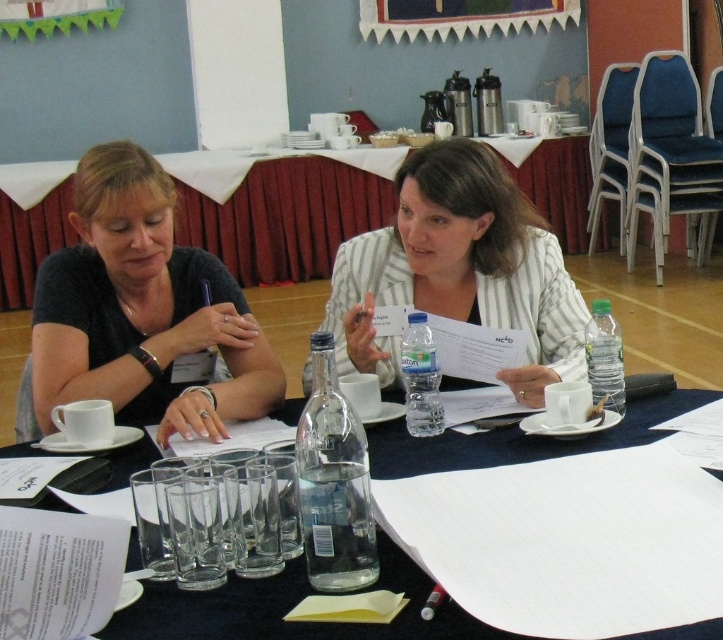
You are organizing a small event and need to decide where to place a new decorative item. Given the current setup, which object would allow more space for the item when placed next to it, the matte black shirt at left or the wooden bulletin board at upper center?

The wooden bulletin board at upper center occupies more space than the matte black shirt at left, so placing the decorative item next to the wooden bulletin board at upper center would allow more space for the item.

You are a photographer setting up for a group photo. You notice the matte black shirt at left and the clear plastic glasses at lower left on the table. Which object should you move to ensure they are balanced in the frame?

The matte black shirt at left has a smaller size compared to clear plastic glasses at lower left, so you should move the clear plastic glasses at lower left closer to the center to balance their visual weight in the frame.

You are standing in the conference room and need to locate the white striped blazer at center. According to the coordinates provided, where exactly would you find it?

The white striped blazer at center is located at coordinates point (461, 268).